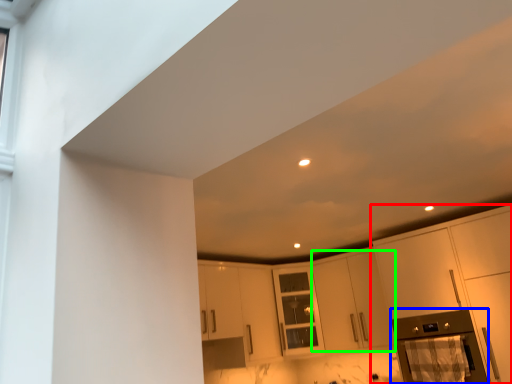
Question: Which object is the closest to the cabinetry (highlighted by a red box)? Choose among these: appliance (highlighted by a blue box) or cabinetry (highlighted by a green box).

Choices:
 (A) appliance
 (B) cabinetry

Answer: (A)